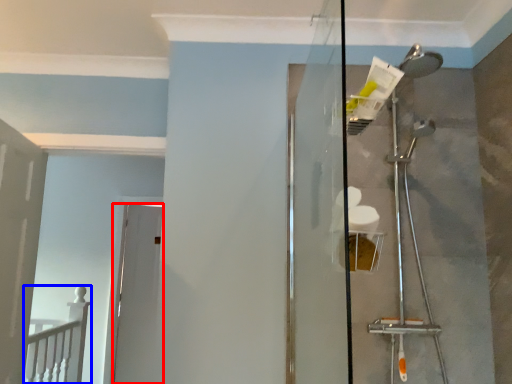
Question: Which object appears farthest to the camera in this image, door (highlighted by a red box) or rail (highlighted by a blue box)?

Choices:
 (A) door
 (B) rail

Answer: (A)